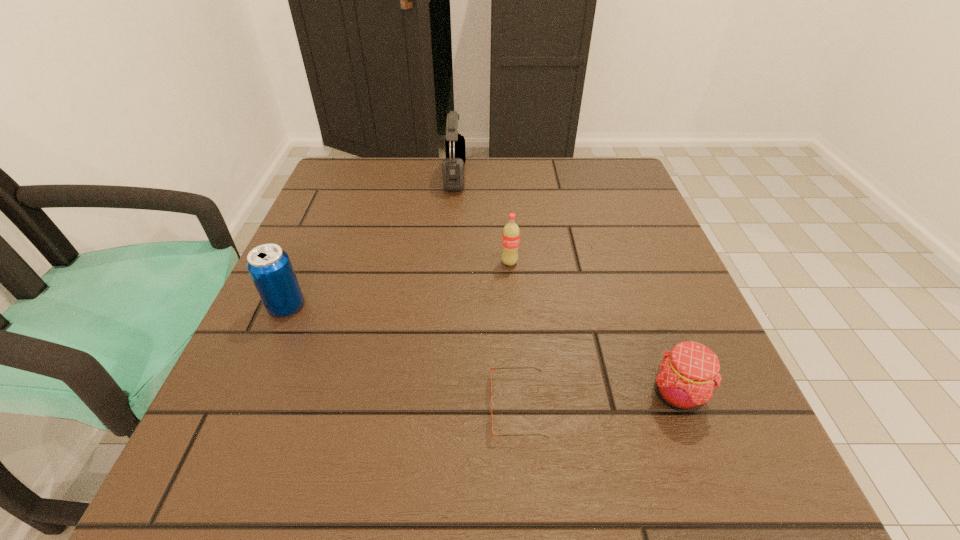
Locate an element on the screen. the tallest object is located at coordinates (453, 165).

What are the coordinates of `the farthest object` in the screenshot? It's located at (453, 165).

Locate an element on the screen. This screenshot has width=960, height=540. the leftmost object is located at coordinates (270, 268).

Identify the location of the nearer soda. (270, 268).

The width and height of the screenshot is (960, 540). What are the coordinates of `the second farthest object` in the screenshot? It's located at (511, 232).

Identify the location of the right soda. (511, 232).

Locate an element on the screen. Image resolution: width=960 pixels, height=540 pixels. the rightmost object is located at coordinates (686, 378).

You are a GUI agent. You are given a task and a screenshot of the screen. Output one action in this format:
    pyautogui.click(x=<x>, y=<y>)
    Task: Click on the jam
    
    Given the screenshot: What is the action you would take?
    pyautogui.click(x=686, y=378)

Where is `sunglasses`? sunglasses is located at coordinates (511, 367).

You are a GUI agent. You are given a task and a screenshot of the screen. Output one action in this format:
    pyautogui.click(x=<x>, y=<y>)
    Task: Click on the free location located 0.090m on the headband of the farthest object
    The width and height of the screenshot is (960, 540).
    Given the screenshot: What is the action you would take?
    pyautogui.click(x=499, y=176)